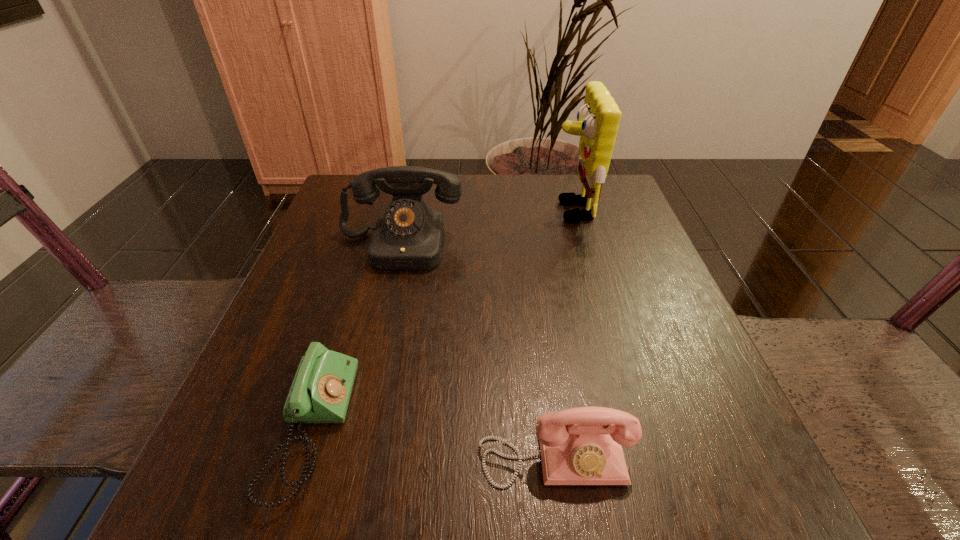
Locate an element on the screen. The image size is (960, 540). free location at the near edge of the desktop is located at coordinates (335, 494).

You are a GUI agent. You are given a task and a screenshot of the screen. Output one action in this format:
    pyautogui.click(x=<x>, y=<y>)
    Task: Click on the free space at the left edge of the desktop
    Image resolution: width=960 pixels, height=540 pixels.
    Given the screenshot: What is the action you would take?
    pyautogui.click(x=343, y=248)

Locate an element on the screen. vacant space at the right edge is located at coordinates (686, 411).

Find the location of a particular element. This screenshot has width=960, height=540. blank space at the far left corner is located at coordinates (388, 205).

What are the coordinates of `vacant space at the near left corner of the desktop` in the screenshot? It's located at (275, 514).

Image resolution: width=960 pixels, height=540 pixels. In the image, there is a desktop. What are the coordinates of `vacant space at the far right corner` in the screenshot? It's located at (565, 190).

Locate an element on the screen. This screenshot has width=960, height=540. free space between the sponge and the shortest object is located at coordinates (442, 320).

The width and height of the screenshot is (960, 540). I want to click on vacant area that lies between the third tallest object and the shortest telephone, so click(x=433, y=442).

Where is `vacant space that is in between the sponge and the shortest object`? This screenshot has width=960, height=540. vacant space that is in between the sponge and the shortest object is located at coordinates (442, 320).

Locate an element on the screen. vacant region between the shortest object and the second shortest telephone is located at coordinates (433, 442).